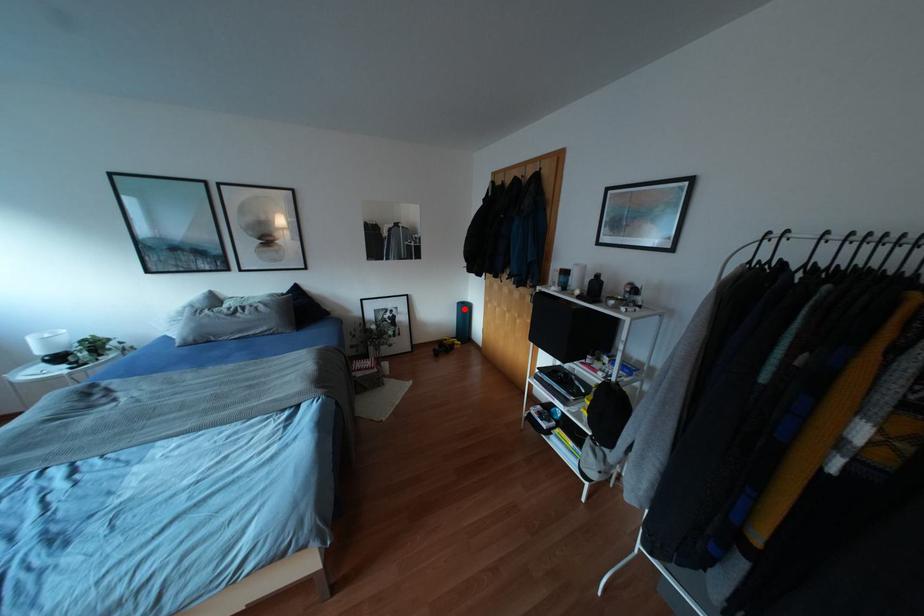
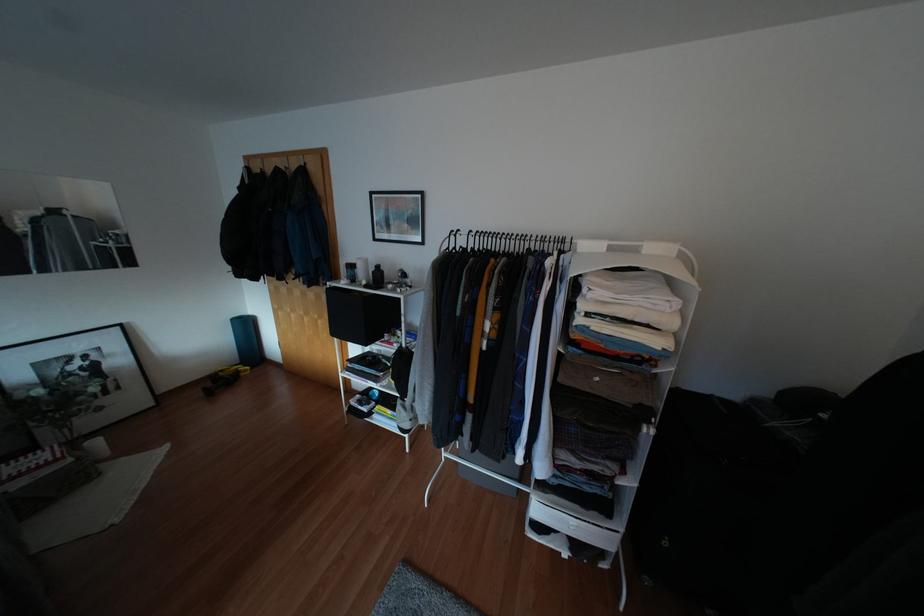
Question: I am providing you with two images of the same scene from different viewpoints. Given a red point in image1, look at the same physical point in image2. Is it:

Choices:
 (A) Closer to the viewpoint
 (B) Farther from the viewpoint

Answer: (B)